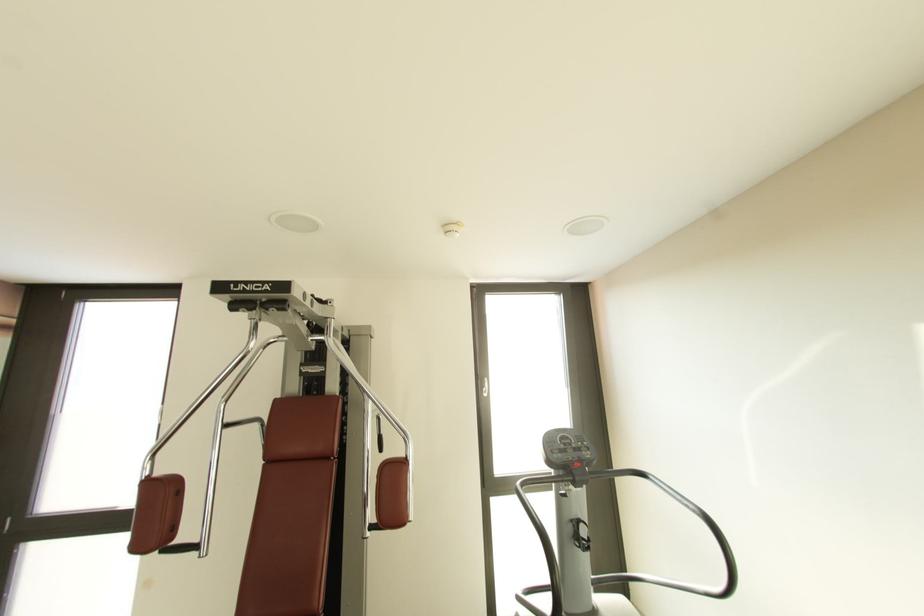
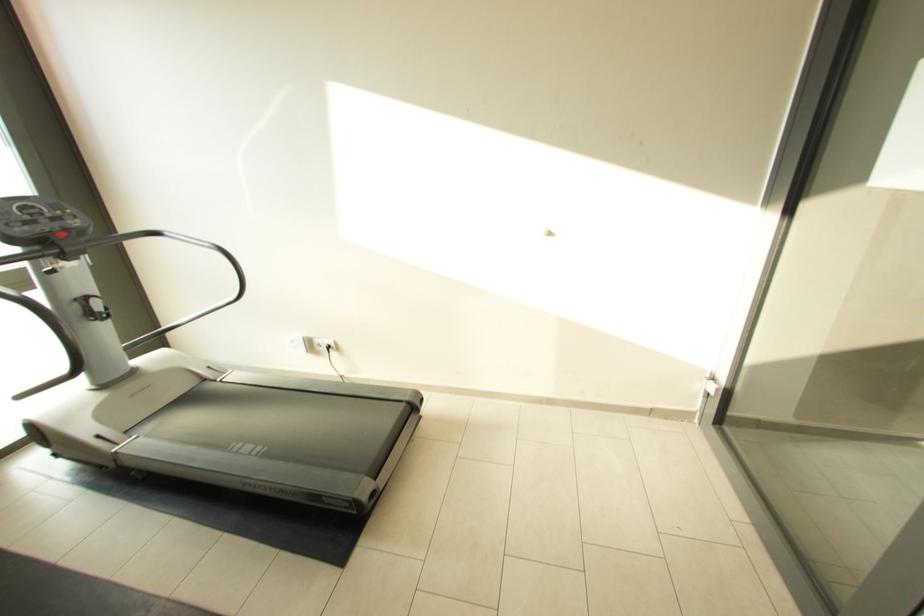
Looking at this image, the images are taken continuously from a first-person perspective. In which direction is your viewpoint rotating?

The camera rotated toward right-down.